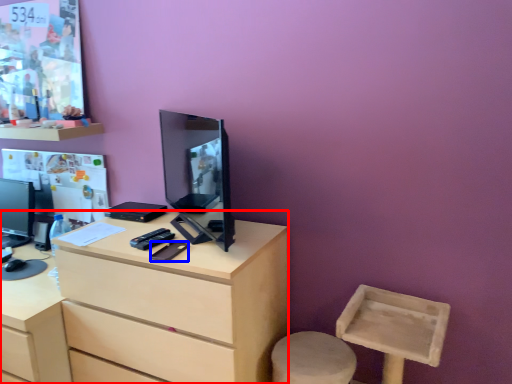
Question: Which object appears closest to the camera in this image, desk (highlighted by a red box) or mobile phone (highlighted by a blue box)?

Choices:
 (A) desk
 (B) mobile phone

Answer: (A)